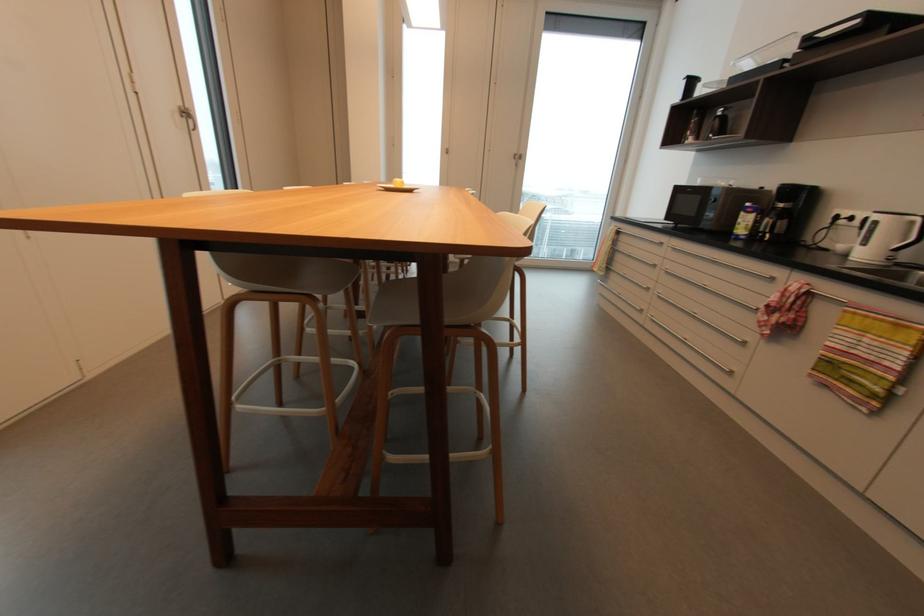
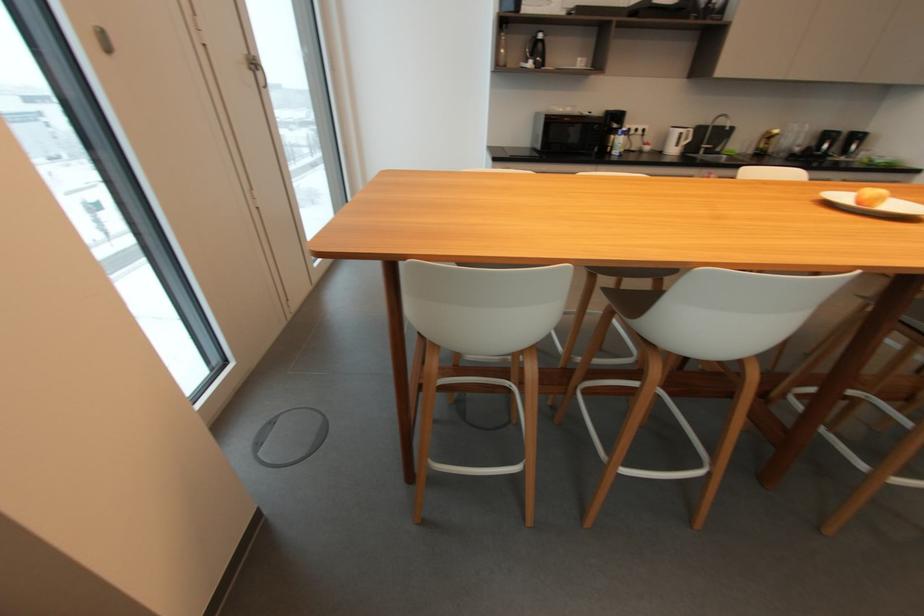
The point at [723,113] is marked in the first image. Where is the corresponding point in the second image?

(544, 36)